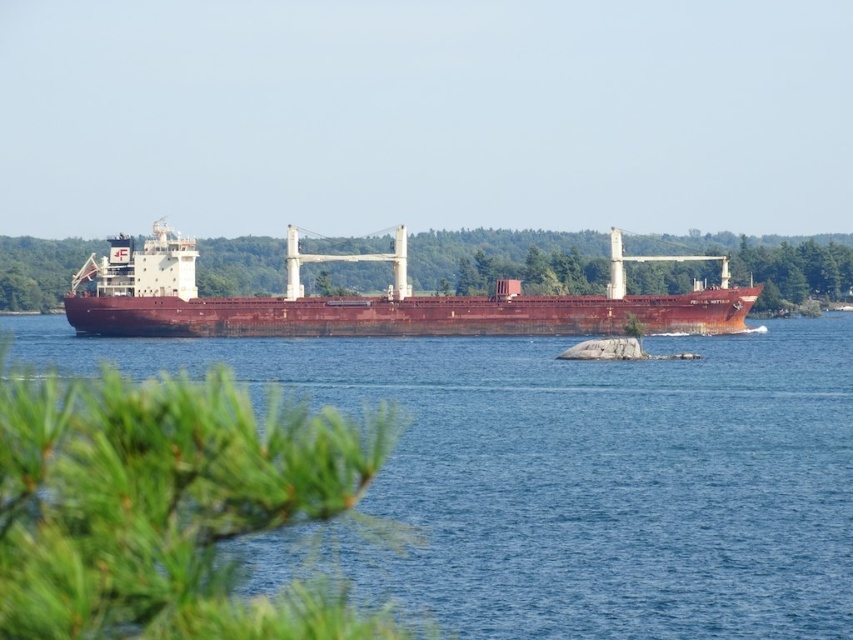
Is brown metallic water at center shorter than rusty metal ship at center?

No, brown metallic water at center is not shorter than rusty metal ship at center.

Is brown metallic water at center to the right of rusty metal ship at center from the viewer's perspective?

No, brown metallic water at center is not to the right of rusty metal ship at center.

Which is behind, point (387, 364) or point (686, 323)?

Positioned behind is point (686, 323).

Find the location of `brown metallic water at center`. brown metallic water at center is located at coordinates (573, 474).